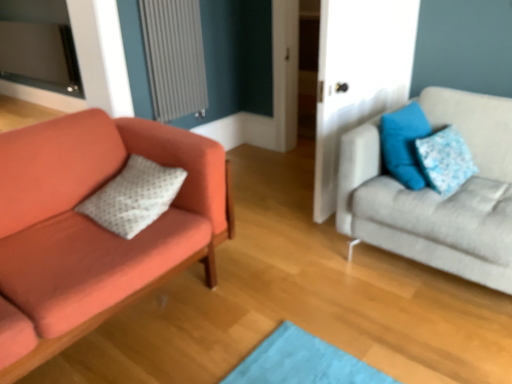
Question: Are matte orange couch at left, which is the first studio couch in left-to-right order, and blue fabric pillow at upper right, positioned as the first pillow in right-to-left order, located far from each other?

Choices:
 (A) no
 (B) yes

Answer: (B)

Question: Is blue fabric pillow at upper right, which ranks as the third pillow in left-to-right order, inside matte orange couch at left, the second studio couch from the right?

Choices:
 (A) yes
 (B) no

Answer: (B)

Question: From the image's perspective, is matte orange couch at left, which is the first studio couch in left-to-right order, under blue fabric pillow at upper right, which ranks as the third pillow in left-to-right order?

Choices:
 (A) yes
 (B) no

Answer: (A)

Question: Does matte orange couch at left, the second studio couch from the right, lie behind blue fabric pillow at upper right, positioned as the first pillow in right-to-left order?

Choices:
 (A) yes
 (B) no

Answer: (B)

Question: Does matte orange couch at left, the second studio couch from the right, have a lesser height compared to blue fabric pillow at upper right, which ranks as the third pillow in left-to-right order?

Choices:
 (A) yes
 (B) no

Answer: (B)

Question: Is matte orange couch at left, which is the first studio couch in left-to-right order, positioned in front of blue fabric pillow at upper right, which ranks as the third pillow in left-to-right order?

Choices:
 (A) yes
 (B) no

Answer: (A)

Question: From a real-world perspective, is matte orange couch at left, the second studio couch from the right, beneath white dotted pillow at left, the first pillow viewed from the left?

Choices:
 (A) no
 (B) yes

Answer: (B)

Question: From the image's perspective, is matte orange couch at left, the second studio couch from the right, under white dotted pillow at left, which appears as the third pillow when viewed from the right?

Choices:
 (A) yes
 (B) no

Answer: (A)

Question: Are matte orange couch at left, the second studio couch from the right, and white dotted pillow at left, which appears as the third pillow when viewed from the right, located far from each other?

Choices:
 (A) yes
 (B) no

Answer: (B)

Question: Is matte orange couch at left, the second studio couch from the right, further to camera compared to white dotted pillow at left, the first pillow viewed from the left?

Choices:
 (A) yes
 (B) no

Answer: (B)

Question: Is matte orange couch at left, the second studio couch from the right, shorter than white dotted pillow at left, the first pillow viewed from the left?

Choices:
 (A) no
 (B) yes

Answer: (A)

Question: From a real-world perspective, is matte orange couch at left, the second studio couch from the right, positioned over white dotted pillow at left, which appears as the third pillow when viewed from the right, based on gravity?

Choices:
 (A) yes
 (B) no

Answer: (B)

Question: Could you tell me if blue fabric pillow at upper right, placed as the 2th pillow when sorted from right to left, is facing gray textured radiator at upper left?

Choices:
 (A) yes
 (B) no

Answer: (B)